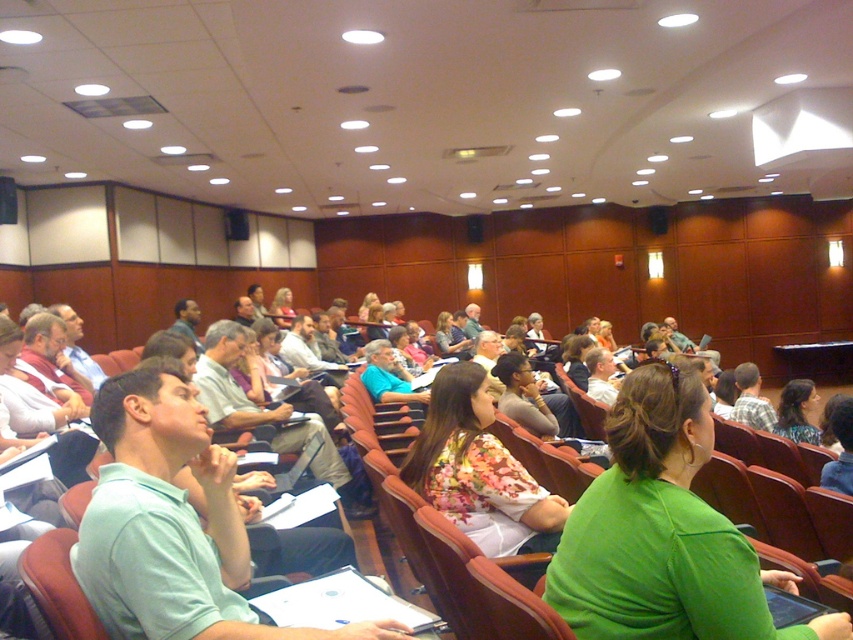
You are sitting in the front row of the lecture hall and notice a person wearing a floral print blouse at center. Can you determine whether this person is seated to your left or right based on their position?

The floral print blouse at center is located at point (479,470), which places it slightly to the right of the center point. Therefore, if you are sitting in the front row facing forward, the person wearing the floral print blouse at center would be seated to your right.

You are sitting in the front row of the lecture hall. You notice two points marked in the image at coordinates point (x=445, y=497) and point (x=793, y=406). Which point is closer to you?

Point (x=445, y=497) is closer to the camera than point (x=793, y=406), so the point closer to you is point (x=445, y=497).

You are an attendee at the lecture hall and notice two people wearing floral patterns. One is wearing a floral print blouse at center and the other a floral fabric dress at center. Which clothing item is larger?

The floral print blouse at center is bigger than the floral fabric dress at center.